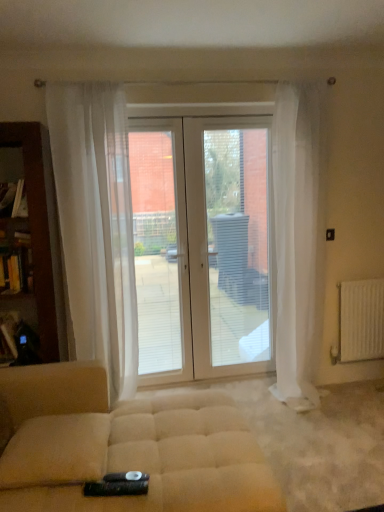
Question: Visually, is brown wood bookshelf at left positioned to the left or to the right of beige fabric ottoman at center?

Choices:
 (A) right
 (B) left

Answer: (B)

Question: Considering their positions, is brown wood bookshelf at left located in front of or behind beige fabric ottoman at center?

Choices:
 (A) front
 (B) behind

Answer: (B)

Question: Based on their relative distances, which object is nearer to the white sheer curtain at right, the second curtain viewed from the left?

Choices:
 (A) beige fabric ottoman at center
 (B) white glossy door at center
 (C) brown wood bookshelf at left
 (D) sheer white curtain at center, which ranks as the first curtain in left-to-right order
 (E) white plastic screen door at center

Answer: (E)

Question: Estimate the real-world distances between objects in this image. Which object is closer to the sheer white curtain at center, which ranks as the first curtain in left-to-right order?

Choices:
 (A) white sheer curtain at right, which ranks as the 1th curtain in right-to-left order
 (B) white metallic radiator at right
 (C) white glossy door at center
 (D) white plastic screen door at center
 (E) beige fabric ottoman at center

Answer: (C)